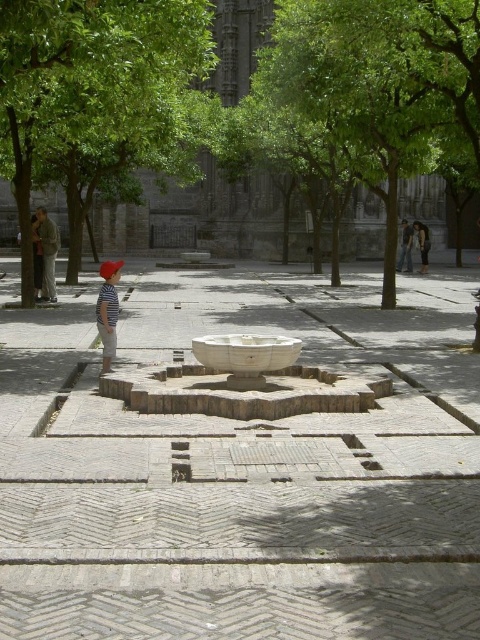
Question: Can you confirm if green leafy tree at upper left is positioned to the left of striped cotton shirt at center?

Choices:
 (A) no
 (B) yes

Answer: (A)

Question: Is green leafy tree at upper left above green leafy tree at center?

Choices:
 (A) no
 (B) yes

Answer: (A)

Question: Observing the image, what is the correct spatial positioning of green leafy tree at upper left in reference to striped cotton shirt at center?

Choices:
 (A) left
 (B) right

Answer: (B)

Question: Which object is positioned closest to the striped cotton shirt at center?

Choices:
 (A) green leafy tree at center
 (B) denim jacket at center
 (C) matte gray statue at left
 (D) green leafy tree at upper left

Answer: (C)

Question: Among these objects, which one is farthest from the camera?

Choices:
 (A) green leafy tree at center
 (B) matte gray statue at left

Answer: (B)

Question: Considering the real-world distances, which object is closest to the denim jacket at center?

Choices:
 (A) green leafy tree at center
 (B) striped cotton shirt at center
 (C) matte gray statue at left

Answer: (A)